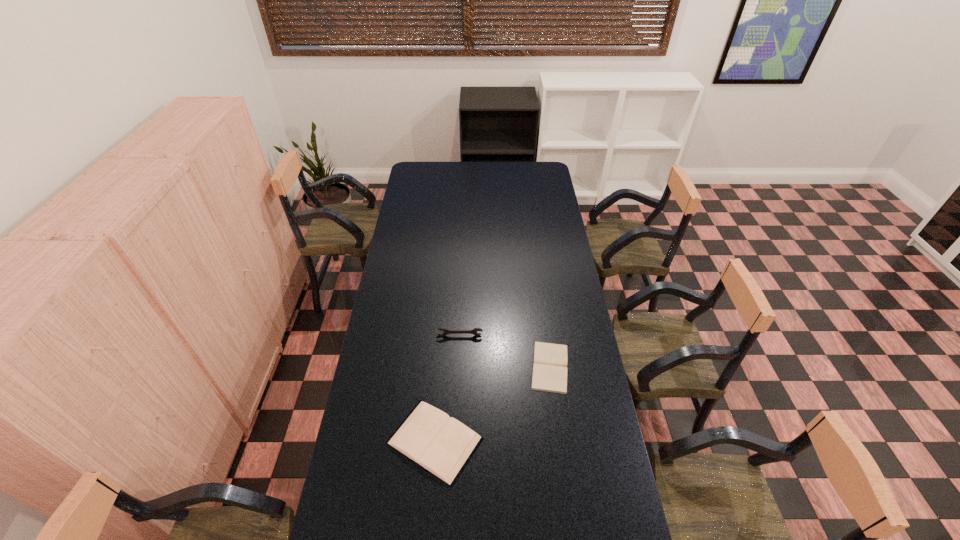
Image resolution: width=960 pixels, height=540 pixels. What are the coordinates of `free space between the tallest object and the nearest object` in the screenshot? It's located at (447, 388).

Find the location of a particular element. The width and height of the screenshot is (960, 540). unoccupied position between the Bible and the wrench is located at coordinates (505, 351).

This screenshot has width=960, height=540. I want to click on free spot between the shortest object and the tallest object, so click(x=505, y=351).

Identify the location of object that stands as the closest to the second shortest object. (549, 370).

You are a GUI agent. You are given a task and a screenshot of the screen. Output one action in this format:
    pyautogui.click(x=<x>, y=<y>)
    Task: Click on the object that is the second nearest to the second nearest object
    This screenshot has width=960, height=540.
    Given the screenshot: What is the action you would take?
    pyautogui.click(x=446, y=331)

The image size is (960, 540). In order to click on vacant area in the image that satisfies the following two spatial constraints: 1. on the open ends of the Bible; 2. on the left side of the tallest object in this screenshot , I will do `click(458, 367)`.

In order to click on vacant space that satisfies the following two spatial constraints: 1. on the open ends of the Bible; 2. on the right side of the wrench in this screenshot , I will do `click(458, 367)`.

Find the location of a particular element. The image size is (960, 540). blank space that satisfies the following two spatial constraints: 1. on the open ends of the second nearest object; 2. on the left side of the wrench is located at coordinates (458, 367).

Where is `vacant area in the image that satisfies the following two spatial constraints: 1. on the open ends of the tallest object; 2. on the left side of the rightmost object`? vacant area in the image that satisfies the following two spatial constraints: 1. on the open ends of the tallest object; 2. on the left side of the rightmost object is located at coordinates (458, 367).